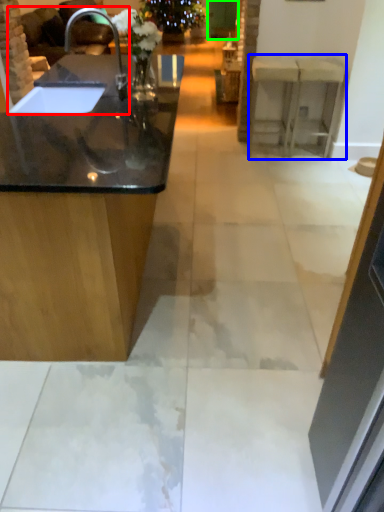
Question: Which is nearer to the sink (highlighted by a red box)? counter (highlighted by a blue box) or glass door (highlighted by a green box).

Choices:
 (A) counter
 (B) glass door

Answer: (A)